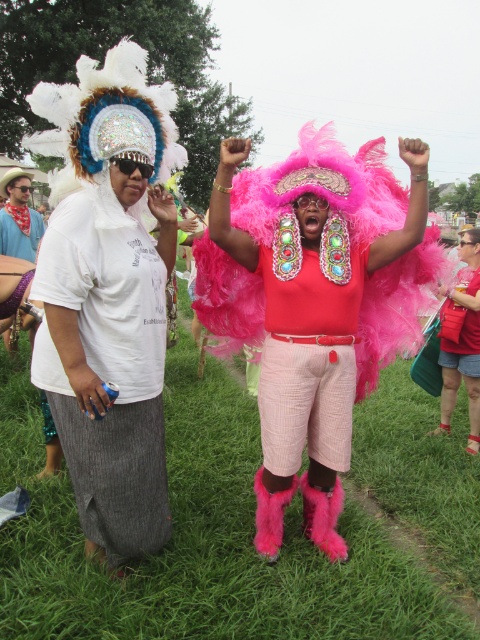
You are a photographer at the event and want to capture both the white textured skirt at left and the brushed metal water at bottle left in the same frame. Based on their positions, which object should you focus on first to ensure both are in the shot?

The white textured skirt at left is to the right of the brushed metal water at bottle left, so focusing on the brushed metal water at bottle left first would allow the photographer to include both objects in the frame.

You are standing in the park and want to take a photo of the person at point [168,536]. If your camera has a maximum focus range of 3 meters, will you be able to capture them clearly?

The distance between you and the person at point [168,536] is 2.75 meters, which is within the camera maximum focus range of 3 meters. Yes, you can capture them clearly.

You are organizing a costume parade and need to ensure that the white textured skirt at left and the brushed metal water at bottle left can fit side by side in a display case. The case is exactly as wide as the wider of the two objects. Which object determines the minimum required width for the case?

The white textured skirt at left is wider than the brushed metal water at bottle left, so the case must be at least as wide as the white textured skirt at left to accommodate both items side by side.